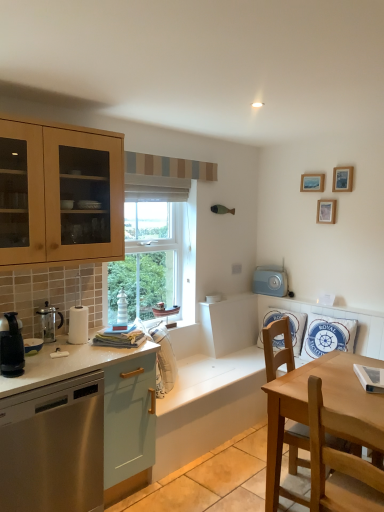
Identify the location of free location to the right of black plastic coffee maker at left, the 1th kitchen appliance from the front. Image resolution: width=384 pixels, height=512 pixels. (47, 370).